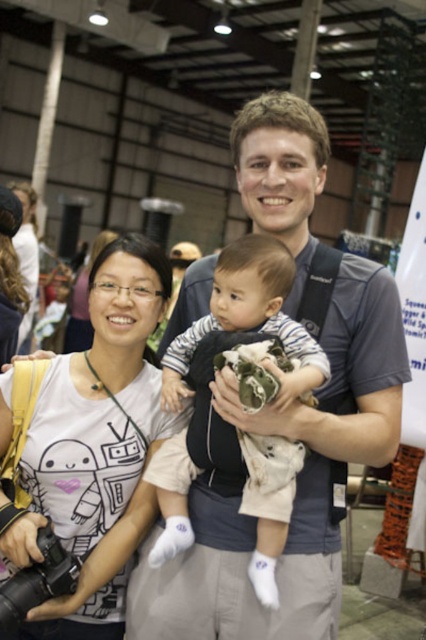
You are a photographer at the event and need to position the matte gray shirt at center and the black plastic camera at lower left for a photo. According to the scene, which object is positioned to the right of the other?

The matte gray shirt at center is to the right of the black plastic camera at lower left.

You are a photographer standing at the event and want to take a closeup shot of the matte gray shirt at center. The camera you are using has a minimum focusing distance of 1.2 meters. Can you take the photo without moving closer?

The matte gray shirt at center is 1.09 meters away from viewer, which is closer than the camera minimum focusing distance of 1.2 meters. Therefore, you cannot take the photo without moving further back or adjusting the camera settings.